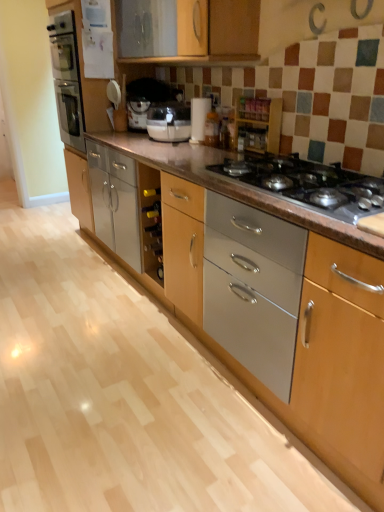
The width and height of the screenshot is (384, 512). I want to click on vacant area on top of wooden spice rack at upper center (from a real-world perspective), so click(x=257, y=97).